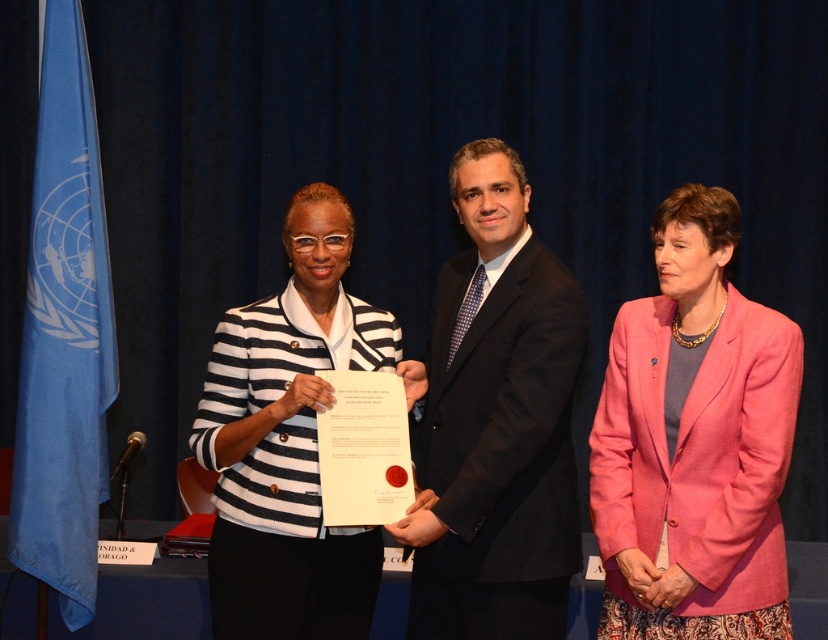
Question: Among these objects, which one is nearest to the camera?

Choices:
 (A) white striped blazer at center
 (B) black suit at center
 (C) pink fabric jacket at center

Answer: (B)

Question: Which point is closer to the camera?

Choices:
 (A) white striped blazer at center
 (B) pink fabric jacket at center

Answer: (B)

Question: Can you confirm if pink fabric jacket at center is smaller than black suit at center?

Choices:
 (A) yes
 (B) no

Answer: (A)

Question: In this image, where is pink fabric jacket at center located relative to black suit at center?

Choices:
 (A) right
 (B) left

Answer: (A)

Question: Which object appears closest to the camera in this image?

Choices:
 (A) white striped blazer at center
 (B) pink fabric jacket at center
 (C) black suit at center

Answer: (C)

Question: Where is black suit at center located in relation to white striped blazer at center in the image?

Choices:
 (A) above
 (B) below

Answer: (A)